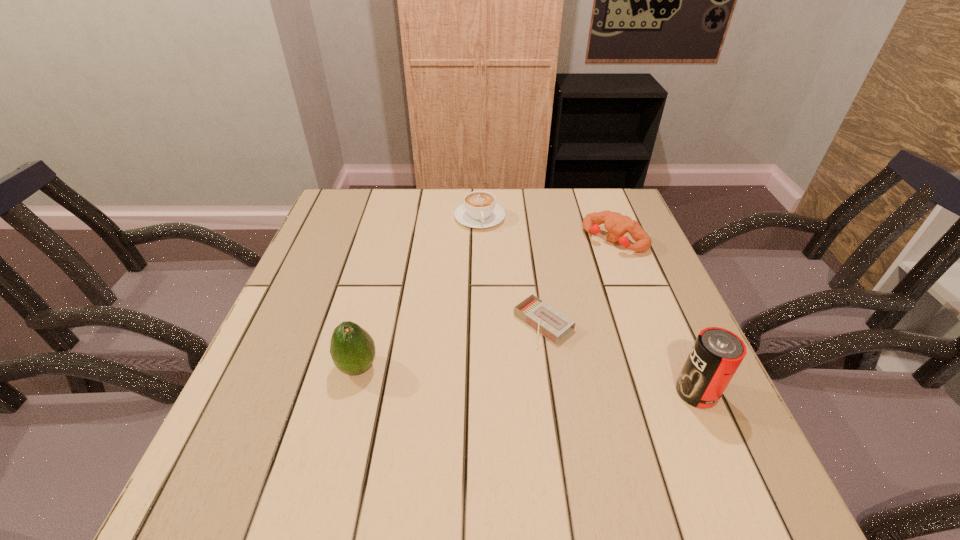
The height and width of the screenshot is (540, 960). I want to click on the second tallest object, so [x=352, y=349].

The width and height of the screenshot is (960, 540). What are the coordinates of `the leftmost object` in the screenshot? It's located at (352, 349).

Identify the location of the tallest object. (717, 353).

Where is `the third shortest object`? the third shortest object is located at coordinates (617, 225).

Locate an element on the screen. the third farthest object is located at coordinates (546, 320).

Image resolution: width=960 pixels, height=540 pixels. Identify the location of matchbox. pyautogui.click(x=546, y=320).

The height and width of the screenshot is (540, 960). I want to click on the fourth tallest object, so click(479, 210).

This screenshot has width=960, height=540. Find the location of `cappuccino`. cappuccino is located at coordinates (479, 210).

This screenshot has height=540, width=960. What are the coordinates of `free space located 0.050m on the right of the leftmost object` in the screenshot? It's located at (403, 367).

Where is `vacant region located on the back of the can`? The height and width of the screenshot is (540, 960). vacant region located on the back of the can is located at coordinates (653, 292).